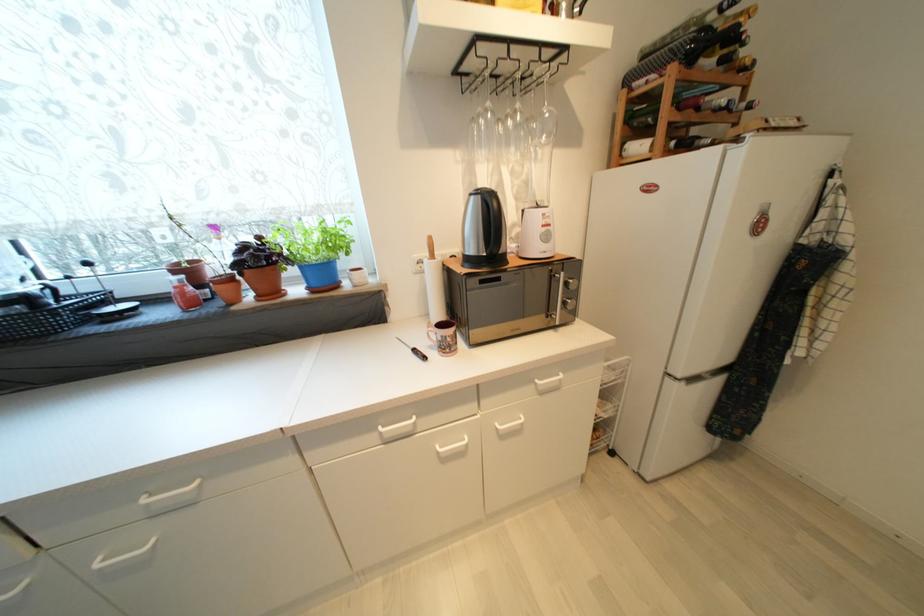
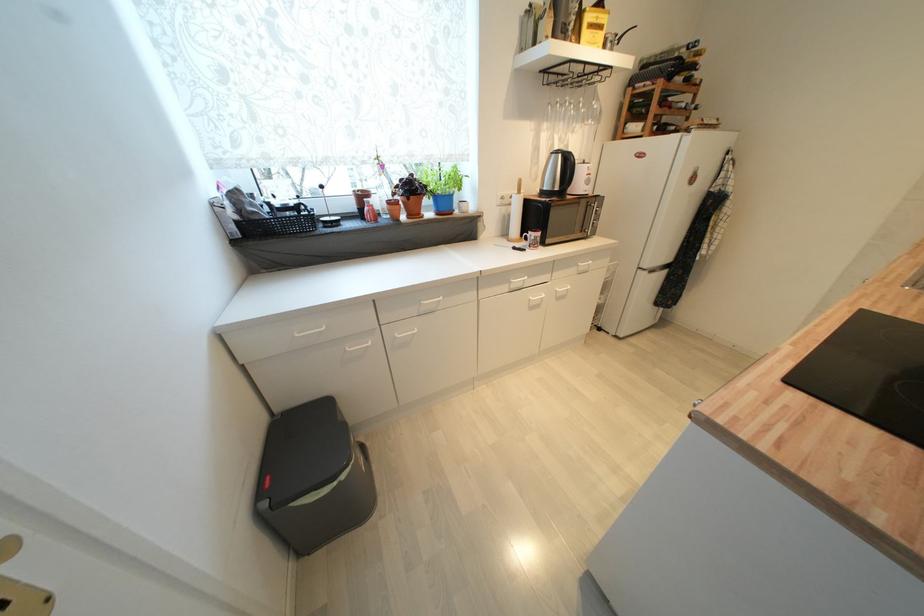
Where in the second image is the point corresponding to [341,245] from the first image?

(463, 184)